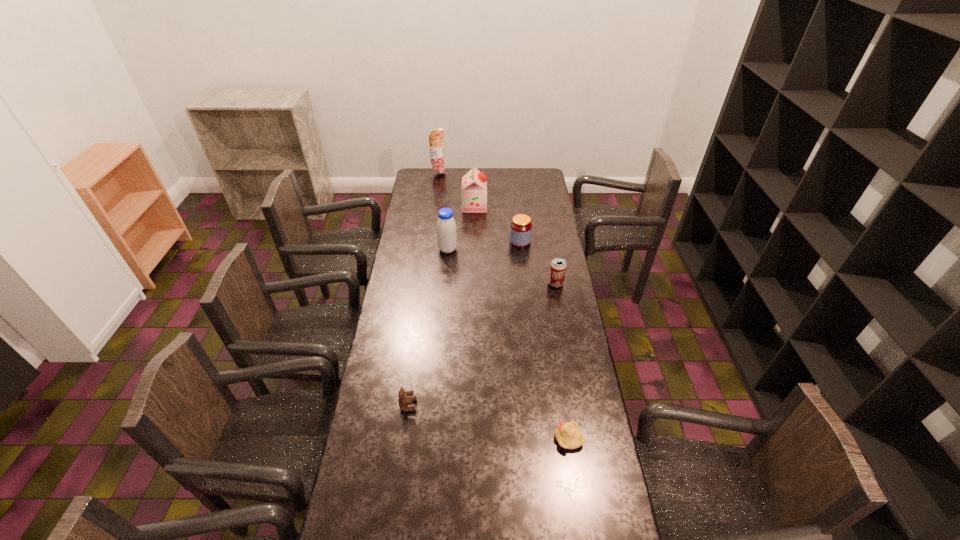
Image resolution: width=960 pixels, height=540 pixels. In order to click on the farthest object in this screenshot , I will do `click(436, 146)`.

Where is `burrito`? The image size is (960, 540). burrito is located at coordinates (436, 146).

Image resolution: width=960 pixels, height=540 pixels. I want to click on the nearer soya milk, so [446, 229].

Find the location of `the left soya milk`. the left soya milk is located at coordinates (446, 229).

This screenshot has width=960, height=540. What are the coordinates of `the second farthest object` in the screenshot? It's located at (474, 184).

The width and height of the screenshot is (960, 540). In order to click on the farther soya milk in this screenshot , I will do tap(474, 184).

Find the location of a particular element. jar is located at coordinates (521, 226).

I want to click on beer can, so click(x=558, y=265).

Locate an element on the screen. the sixth farthest object is located at coordinates (403, 401).

The width and height of the screenshot is (960, 540). I want to click on the shortest object, so click(x=568, y=436).